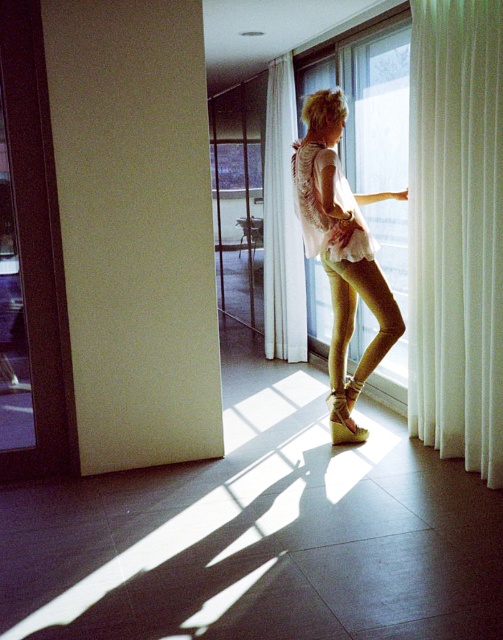
Question: Among these objects, which one is farthest from the camera?

Choices:
 (A) white sheer curtain at right
 (B) white sheer curtain at center
 (C) white lace dress at center

Answer: (B)

Question: Which point is farther to the camera?

Choices:
 (A) white sheer curtain at center
 (B) transparent glass door at center
 (C) white lace dress at center
 (D) white sheer curtain at right

Answer: (B)

Question: Which object is closer to the camera taking this photo?

Choices:
 (A) white lace dress at center
 (B) white sheer curtain at center
 (C) transparent glass door at center
 (D) light beige fabric blouse at center

Answer: (D)

Question: Is light beige fabric blouse at center wider than transparent glass door at center?

Choices:
 (A) no
 (B) yes

Answer: (B)

Question: Is the position of white sheer curtain at right more distant than that of transparent glass door at center?

Choices:
 (A) yes
 (B) no

Answer: (B)

Question: Is the position of transparent glass door at center more distant than that of white sheer curtain at center?

Choices:
 (A) yes
 (B) no

Answer: (A)